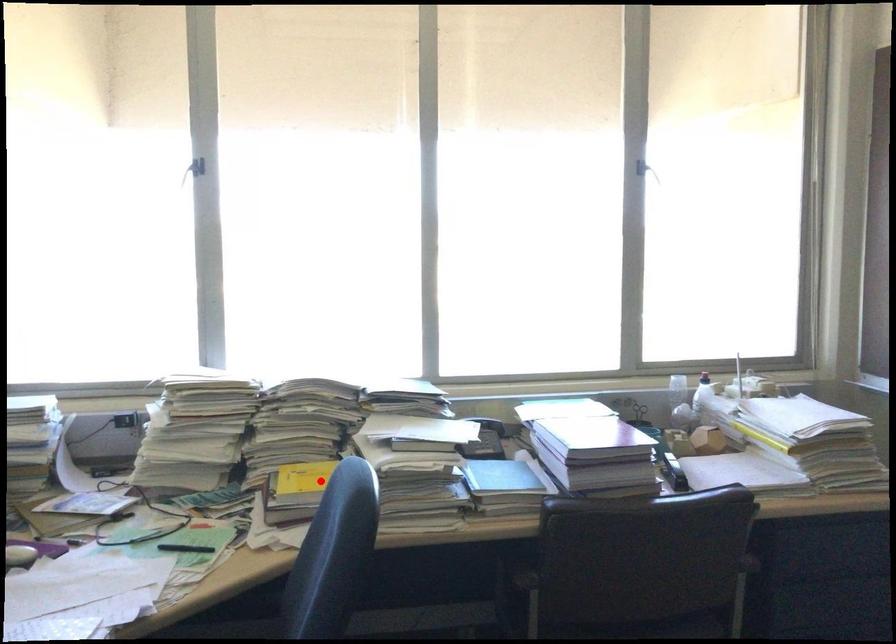
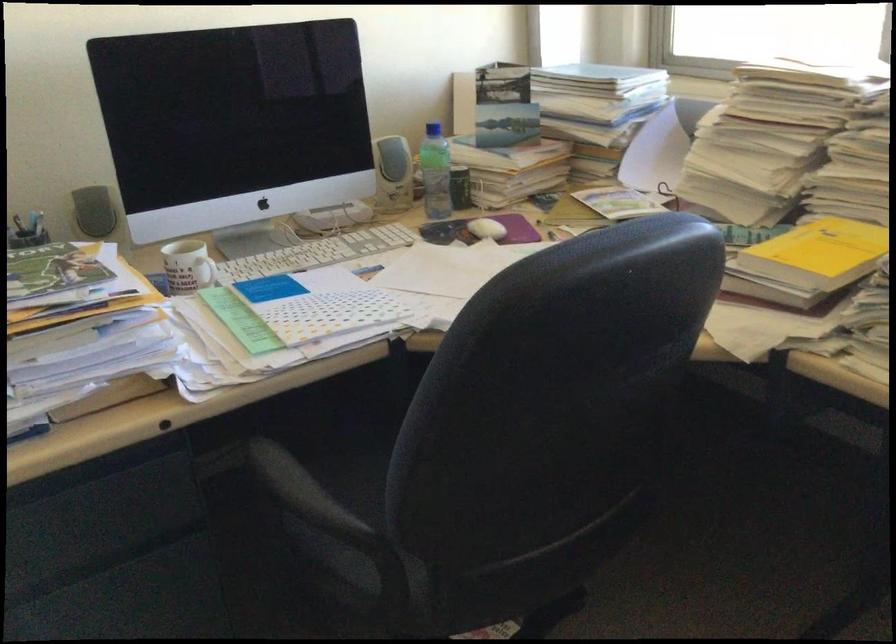
Where in the second image is the point corresponding to the highlighted location from the first image?

(819, 252)